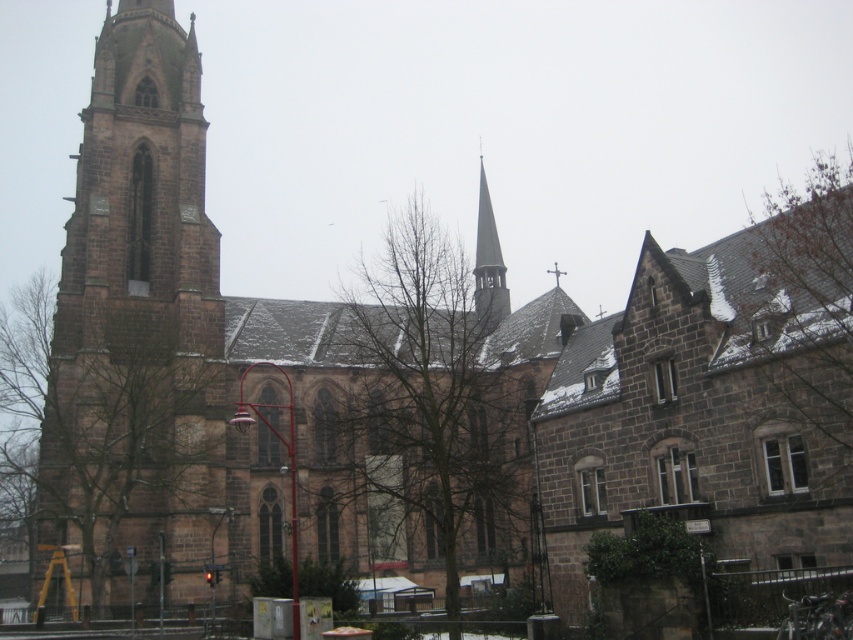
You are standing in front of the historic stone church and want to locate the brown stone tower at left. According to the coordinates provided, where should you look relative to the center of the image?

The brown stone tower at left is located at coordinates point (135, 310), which means it is positioned slightly to the left and lower than the center of the image.

You are an architect analyzing the church structure. Based on the image, which object is taller between the brown stone tower at left and the smooth gray spire at center?

The brown stone tower at left is taller than the smooth gray spire at center according to the description.

You are an architect analyzing the church structure. You need to compare the widths of the brown stone tower at left and the smooth gray spire at center. Which one is wider?

The brown stone tower at left is wider than the smooth gray spire at center.